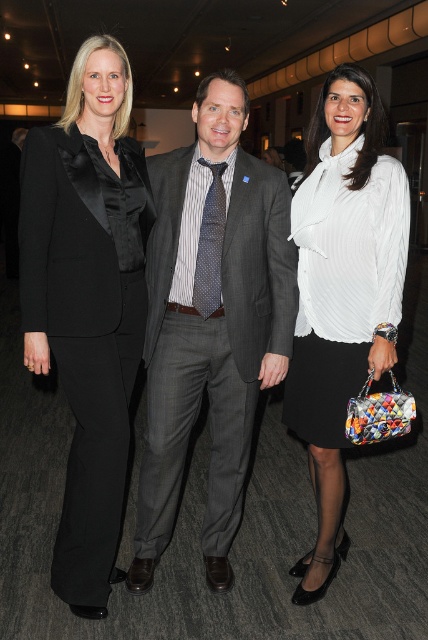
Is black satin blazer at left further to camera compared to polka dot silk tie at center?

No.

Does black satin blazer at left appear on the right side of polka dot silk tie at center?

Incorrect, black satin blazer at left is not on the right side of polka dot silk tie at center.

Is point (121, 259) positioned behind point (222, 218)?

No, (121, 259) is closer to viewer.

Locate an element on the screen. Image resolution: width=428 pixels, height=640 pixels. black satin blazer at left is located at coordinates (86, 328).

Is gray pinstripe suit at center further to camera compared to white pleated blouse at center?

Yes, gray pinstripe suit at center is behind white pleated blouse at center.

Is gray pinstripe suit at center wider than white pleated blouse at center?

Yes, gray pinstripe suit at center is wider than white pleated blouse at center.

Who is more distant from viewer, (282, 342) or (332, 404)?

Point (282, 342)

Locate an element on the screen. gray pinstripe suit at center is located at coordinates (211, 321).

Who is lower down, white pleated blouse at center or polka dot silk tie at center?

Positioned lower is white pleated blouse at center.

Does white pleated blouse at center come behind polka dot silk tie at center?

No, it is not.

Identify the location of white pleated blouse at center. (341, 292).